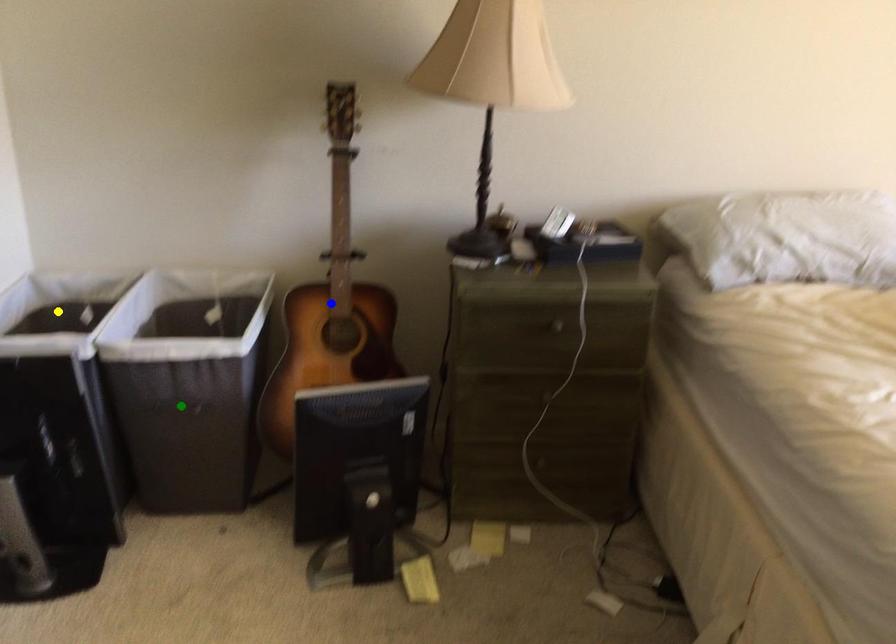
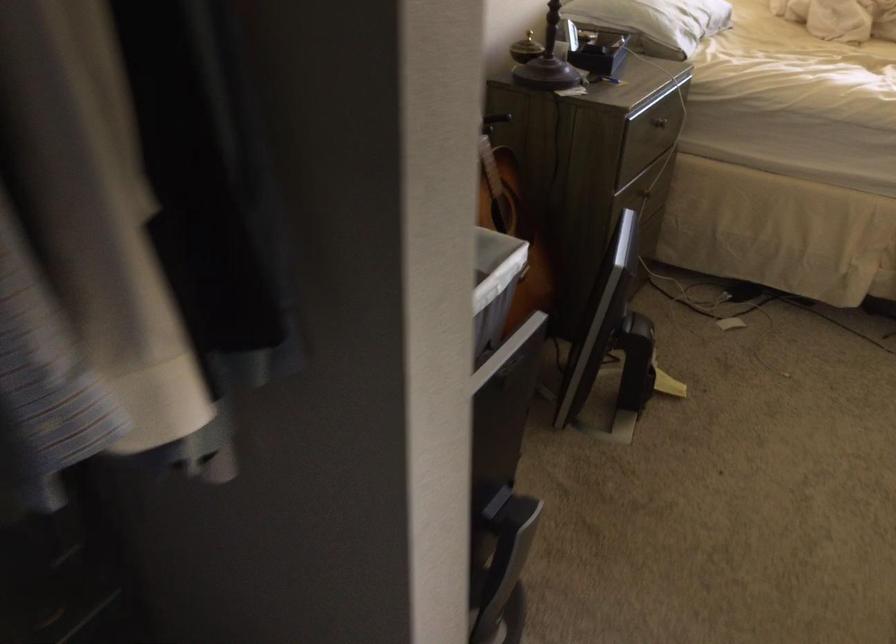
I am providing you with two images of the same scene from different viewpoints. Three points are marked in image1. Which point corresponds to a part or object that is occluded in image2?In image1, three points are marked. Which of them correspond to a part or object that is occluded in image2?Among the three points shown in image1, which one corresponds to a part or object that is no longer visible due to occlusion in image2?

blue point, green point, yellow point cannot be seen in image2.